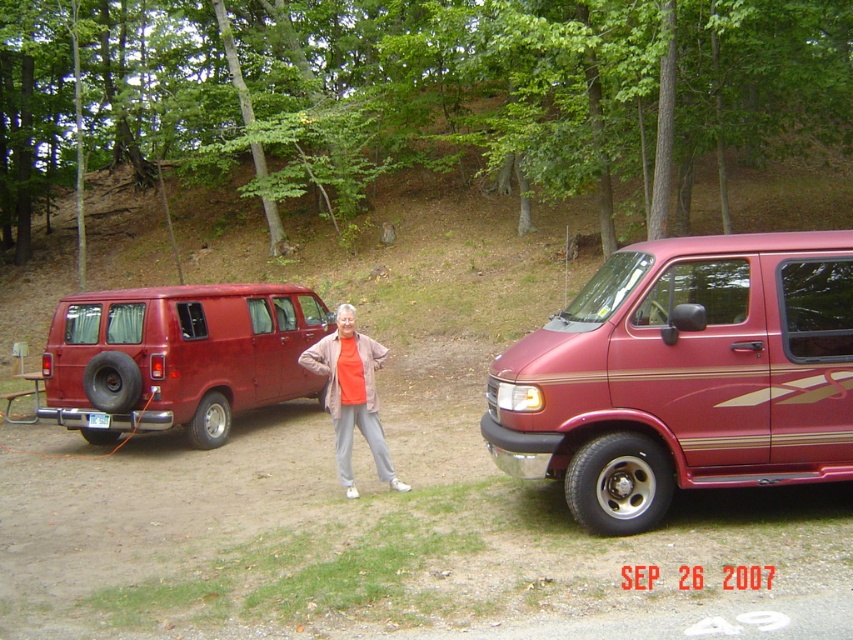
Is matte red van at left above orange fabric jacket at center?

Correct, matte red van at left is located above orange fabric jacket at center.

Is point (126, 412) closer to viewer compared to point (357, 380)?

No, it is not.

Locate an element on the screen. matte red van at left is located at coordinates (178, 356).

Which is behind, point (596, 349) or point (375, 362)?

Point (375, 362)

Who is more distant from viewer, (x=624, y=403) or (x=357, y=428)?

Point (x=357, y=428)

Where is `shiny maroon van at center`? This screenshot has width=853, height=640. shiny maroon van at center is located at coordinates (683, 376).

Is shiny maroon van at center positioned before matte red van at left?

That is True.

Who is more forward, (830, 381) or (263, 360)?

Positioned in front is point (830, 381).

The image size is (853, 640). I want to click on shiny maroon van at center, so click(x=683, y=376).